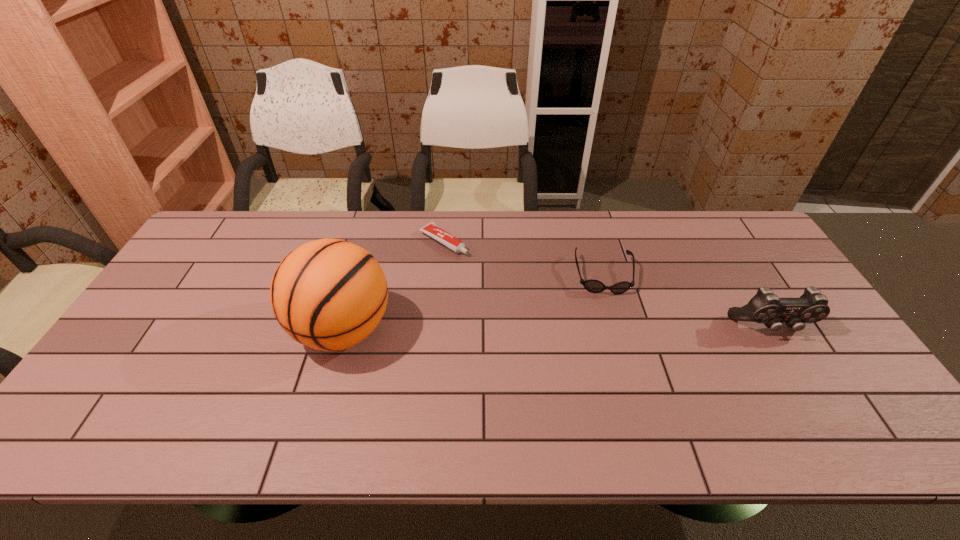
This screenshot has height=540, width=960. I want to click on free space on the desktop that is between the leftmost object and the rightmost object and is positioned on the lenses of the second object from right to left, so click(612, 328).

Locate an element on the screen. free space on the desktop that is between the leftmost object and the control and is positioned at the nozzle of the toothpaste is located at coordinates (576, 328).